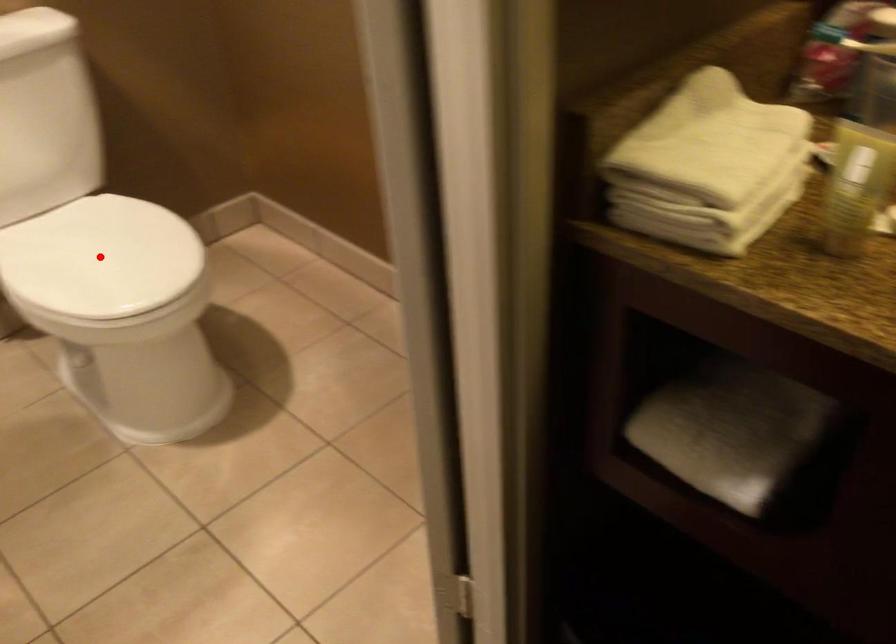
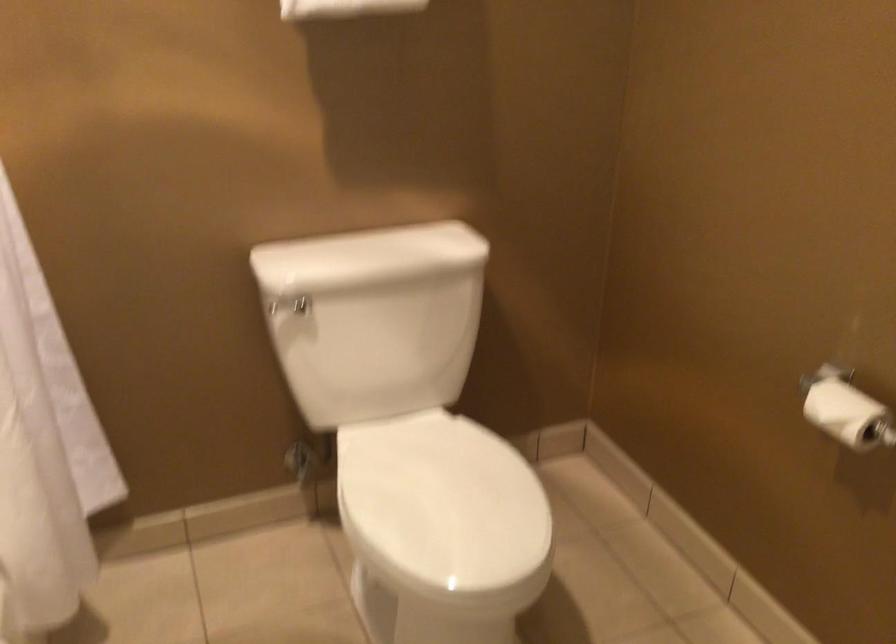
Question: I am providing you with two images of the same scene from different viewpoints. A red point is shown in image1. For the corresponding object point in image2, is it positioned nearer or farther from the camera?

Choices:
 (A) Nearer
 (B) Farther

Answer: (A)